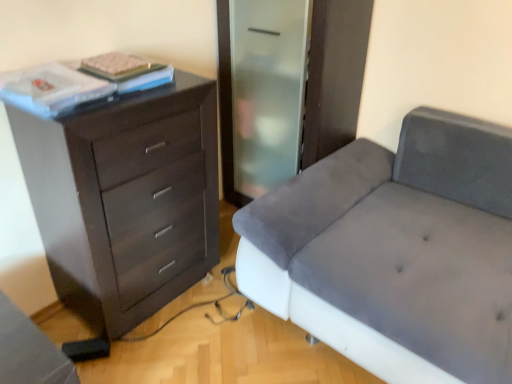
Question: From the image's perspective, is dark wood chest of drawers at left over white matte book at upper left?

Choices:
 (A) no
 (B) yes

Answer: (A)

Question: Is white matte book at upper left surrounded by dark wood chest of drawers at left?

Choices:
 (A) yes
 (B) no

Answer: (B)

Question: Is dark wood chest of drawers at left oriented towards white matte book at upper left?

Choices:
 (A) no
 (B) yes

Answer: (A)

Question: Is dark wood chest of drawers at left smaller than white matte book at upper left?

Choices:
 (A) no
 (B) yes

Answer: (A)

Question: Does dark wood chest of drawers at left have a lesser width compared to white matte book at upper left?

Choices:
 (A) no
 (B) yes

Answer: (A)

Question: Is dark wood chest of drawers at left inside the boundaries of velvet grey couch at right, or outside?

Choices:
 (A) inside
 (B) outside

Answer: (B)

Question: In terms of height, does dark wood chest of drawers at left look taller or shorter compared to velvet grey couch at right?

Choices:
 (A) short
 (B) tall

Answer: (B)

Question: Is point (71, 306) closer or farther from the camera than point (368, 145)?

Choices:
 (A) farther
 (B) closer

Answer: (B)

Question: From a real-world perspective, is dark wood chest of drawers at left positioned above or below velvet grey couch at right?

Choices:
 (A) above
 (B) below

Answer: (A)

Question: Relative to white matte book at upper left, is dark wood chest of drawers at left in front or behind?

Choices:
 (A) front
 (B) behind

Answer: (A)

Question: Looking at their shapes, would you say dark wood chest of drawers at left is wider or thinner than white matte book at upper left?

Choices:
 (A) thin
 (B) wide

Answer: (B)

Question: From the image's perspective, is dark wood chest of drawers at left positioned above or below white matte book at upper left?

Choices:
 (A) below
 (B) above

Answer: (A)

Question: Does point (123, 172) appear closer or farther from the camera than point (136, 74)?

Choices:
 (A) closer
 (B) farther

Answer: (A)

Question: Does point (448, 210) appear closer or farther from the camera than point (59, 248)?

Choices:
 (A) farther
 (B) closer

Answer: (A)

Question: In terms of size, does velvet grey couch at right appear bigger or smaller than dark wood chest of drawers at left?

Choices:
 (A) big
 (B) small

Answer: (A)